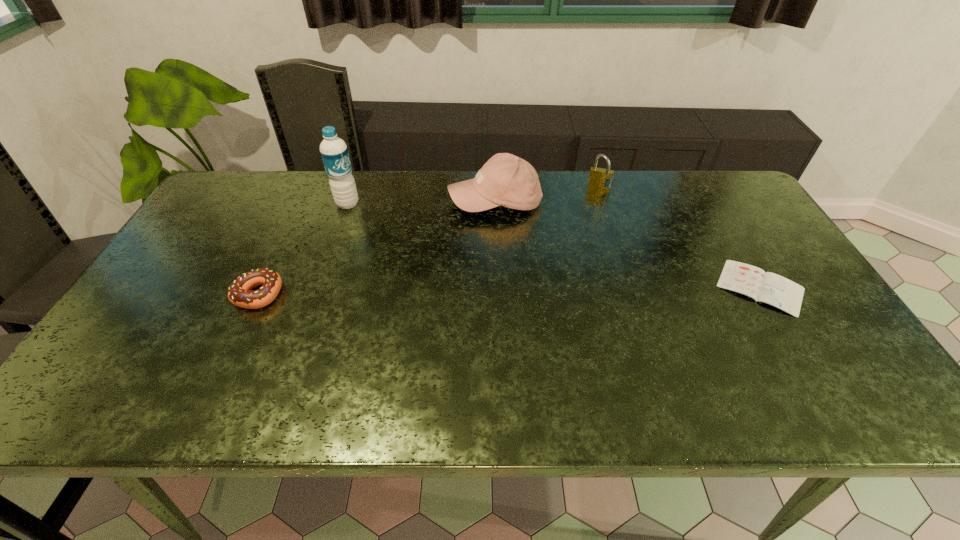
Where is `free spot located on the label of the second object from left to right`? free spot located on the label of the second object from left to right is located at coordinates (367, 217).

You are a GUI agent. You are given a task and a screenshot of the screen. Output one action in this format:
    pyautogui.click(x=<x>, y=<y>)
    Task: Click on the padlock at the far edge
    The image size is (960, 540).
    Given the screenshot: What is the action you would take?
    pyautogui.click(x=600, y=178)

Image resolution: width=960 pixels, height=540 pixels. Identify the location of baseball cap that is at the far edge. (506, 180).

Identify the location of water bottle present at the far edge. This screenshot has height=540, width=960. (334, 152).

I want to click on object that is at the right edge, so click(x=767, y=287).

What are the coordinates of `free space at the far edge of the desktop` in the screenshot? It's located at (450, 200).

The image size is (960, 540). In the image, there is a desktop. Find the location of `free space at the near edge`. free space at the near edge is located at coordinates (238, 368).

Image resolution: width=960 pixels, height=540 pixels. In the image, there is a desktop. In order to click on vacant region at the left edge in this screenshot , I will do `click(173, 258)`.

I want to click on blank area at the right edge, so click(793, 276).

Locate an element on the screen. The image size is (960, 540). free space at the far left corner is located at coordinates (269, 182).